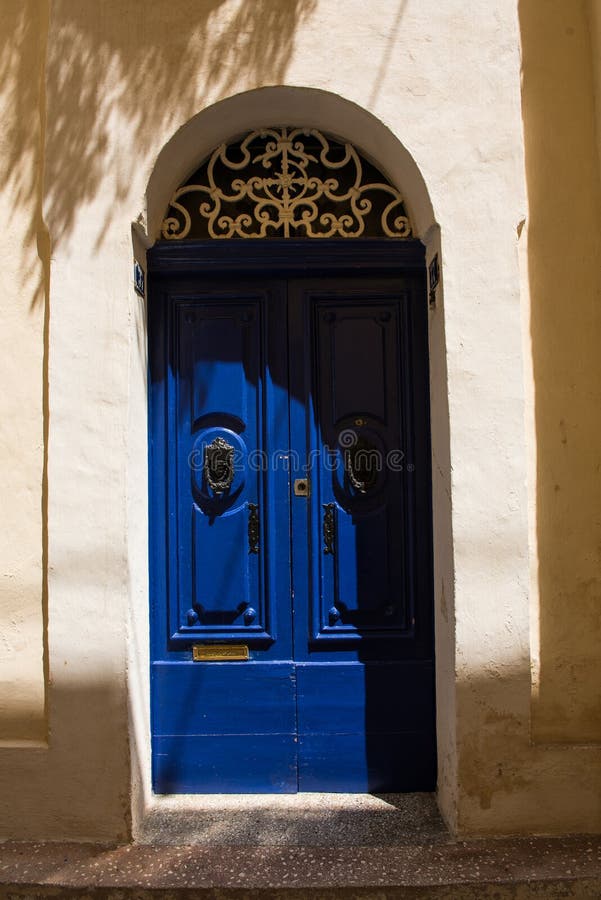
At what (x,y) coordinates should I click in order to perform the action: click on stairs. Please return your answer as a coordinate pair (x, y). Looking at the image, I should click on (326, 874).